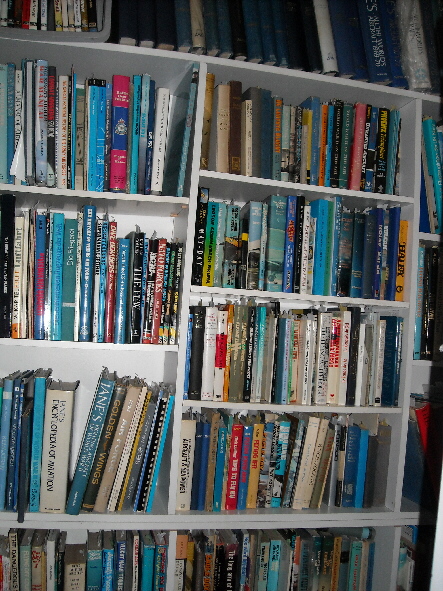
I want to click on shelves, so click(x=216, y=521), click(x=220, y=515), click(x=261, y=407), click(x=289, y=292), click(x=343, y=85).